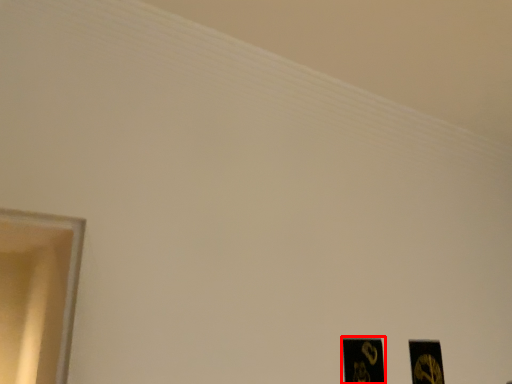
Question: Considering the relative positions of picture frame (annotated by the red box) and picture frame in the image provided, where is picture frame (annotated by the red box) located with respect to the staircase?

Choices:
 (A) left
 (B) right

Answer: (A)